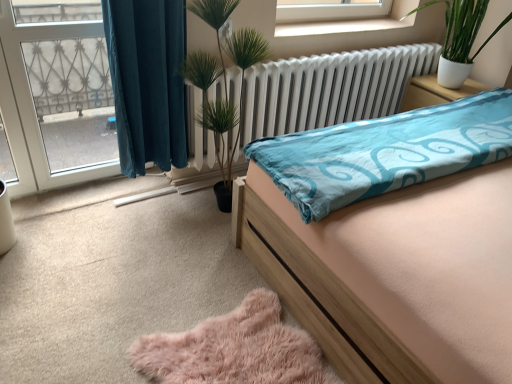
Locate an element on the screen. The width and height of the screenshot is (512, 384). vacant region to the right of transparent glass door at left is located at coordinates (108, 207).